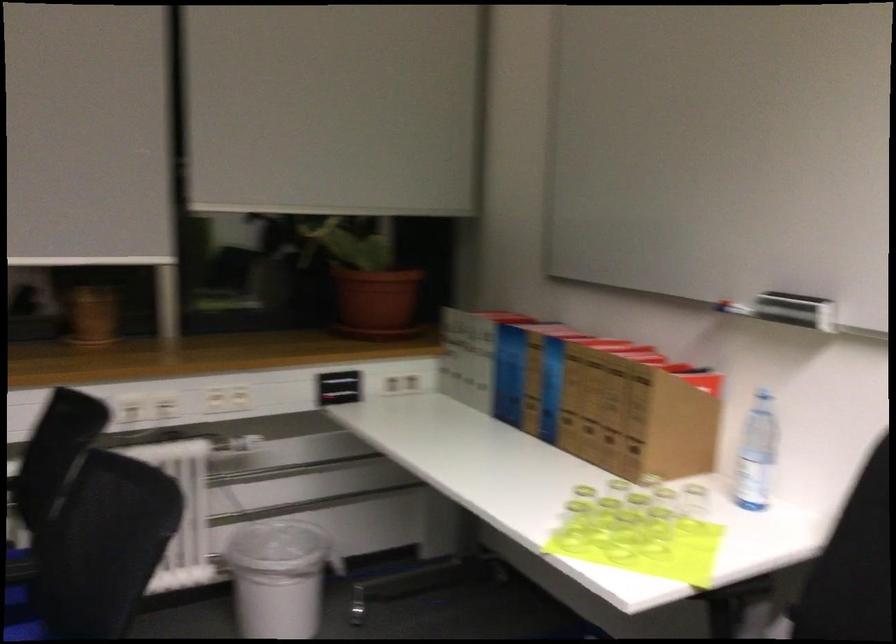
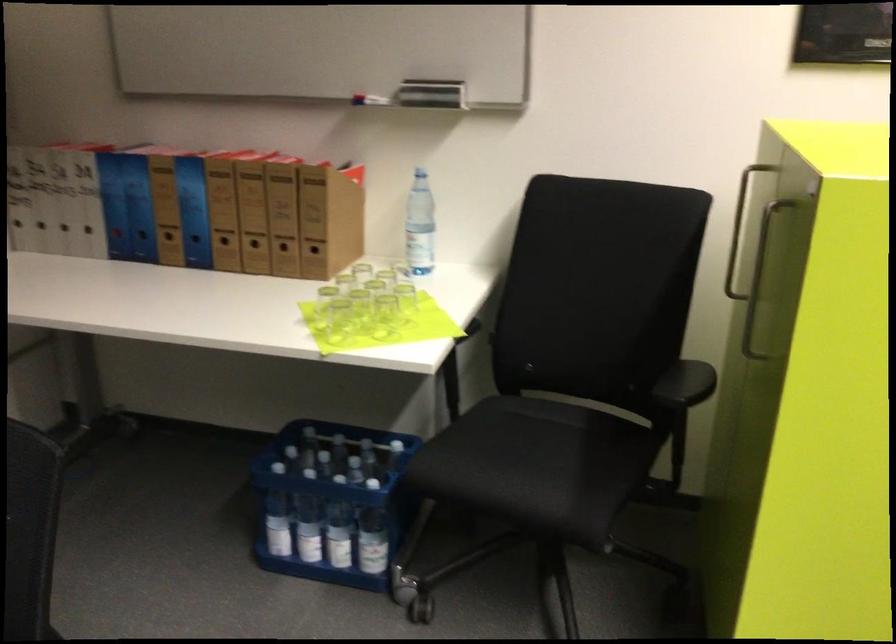
In the second image, find the point that corresponds to pixel 606 444 in the first image.

(283, 252)